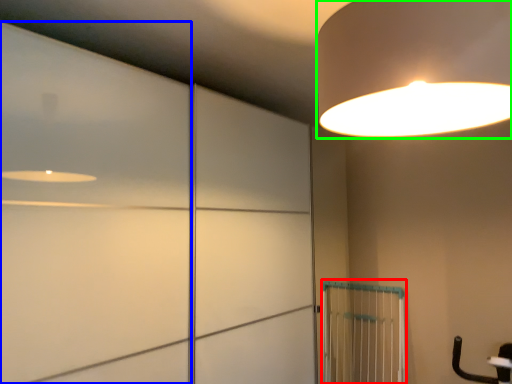
Question: Which object is positioned closest to cage (highlighted by a red box)? Select from door (highlighted by a blue box) and lamp (highlighted by a green box).

Choices:
 (A) door
 (B) lamp

Answer: (A)